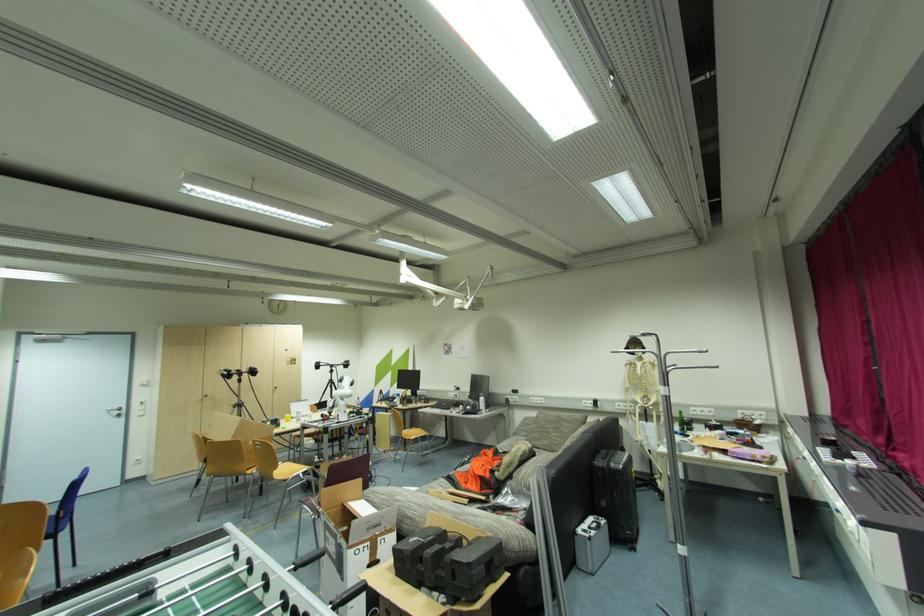
Locate an element on the screen. Image resolution: width=924 pixels, height=616 pixels. silver case handle is located at coordinates (596, 525).